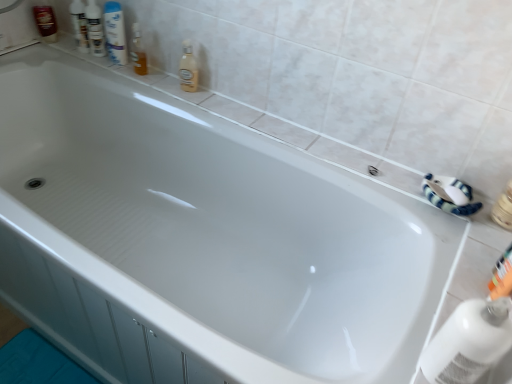
Question: Would you say shiny brown bottle at upper left, the first toiletry when ordered from back to front, is part of white glossy mouthwash at upper left's contents?

Choices:
 (A) no
 (B) yes

Answer: (A)

Question: From the image's perspective, is white glossy mouthwash at upper left beneath shiny brown bottle at upper left, the first toiletry in the top-to-bottom sequence?

Choices:
 (A) yes
 (B) no

Answer: (A)

Question: Can you confirm if white glossy mouthwash at upper left is smaller than shiny brown bottle at upper left, the 5th toiletry viewed from the right?

Choices:
 (A) yes
 (B) no

Answer: (B)

Question: Are white glossy mouthwash at upper left and shiny brown bottle at upper left, the fifth toiletry viewed from the front, making contact?

Choices:
 (A) no
 (B) yes

Answer: (A)

Question: Does white glossy mouthwash at upper left have a lesser height compared to shiny brown bottle at upper left, the fifth toiletry in the bottom-to-top sequence?

Choices:
 (A) no
 (B) yes

Answer: (A)

Question: Which is correct: translucent plastic bottle at upper center, which is counted as the second cleaning product, starting from the front, is inside white glossy shampoo bottles at upper left, which appears as the 4th toiletry when viewed from the front, or outside of it?

Choices:
 (A) inside
 (B) outside

Answer: (B)

Question: From the image's perspective, is translucent plastic bottle at upper center, which is counted as the second cleaning product, starting from the front, above or below white glossy shampoo bottles at upper left, the 4th toiletry positioned from the bottom?

Choices:
 (A) above
 (B) below

Answer: (B)

Question: From their relative heights in the image, would you say translucent plastic bottle at upper center, which is counted as the second cleaning product, starting from the front, is taller or shorter than white glossy shampoo bottles at upper left, which appears as the 4th toiletry when viewed from the front?

Choices:
 (A) short
 (B) tall

Answer: (A)

Question: Is point (187, 81) positioned closer to the camera than point (81, 21)?

Choices:
 (A) closer
 (B) farther

Answer: (A)

Question: Does point (37, 23) appear closer or farther from the camera than point (189, 66)?

Choices:
 (A) farther
 (B) closer

Answer: (A)

Question: Looking at the image, does shiny brown bottle at upper left, the first toiletry in the top-to-bottom sequence, seem bigger or smaller compared to translucent plastic bottle at upper center, which is counted as the second cleaning product, starting from the front?

Choices:
 (A) small
 (B) big

Answer: (A)

Question: Looking at their shapes, would you say shiny brown bottle at upper left, the first toiletry when ordered from back to front, is wider or thinner than translucent plastic bottle at upper center, which appears as the first cleaning product when viewed from the left?

Choices:
 (A) thin
 (B) wide

Answer: (A)

Question: Relative to translucent plastic bottle at upper center, placed as the first cleaning product when sorted from top to bottom, is shiny brown bottle at upper left, arranged as the 1th toiletry when viewed from the left, in front or behind?

Choices:
 (A) front
 (B) behind

Answer: (B)

Question: In the image, is translucent plastic soap dispenser at upper center, positioned as the 4th toiletry in left-to-right order, on the left side or the right side of orange plastic toothbrush at lower right, which ranks as the first toiletry in right-to-left order?

Choices:
 (A) right
 (B) left

Answer: (B)

Question: From a real-world perspective, is translucent plastic soap dispenser at upper center, positioned as the 4th toiletry in top-to-bottom order, positioned above or below orange plastic toothbrush at lower right, positioned as the first toiletry in front-to-back order?

Choices:
 (A) above
 (B) below

Answer: (A)